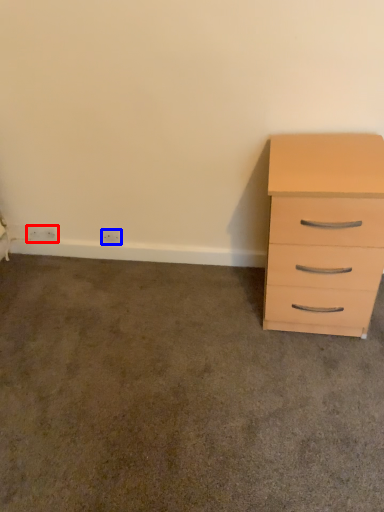
Question: Which point is closer to the camera, electric outlet (highlighted by a red box) or electric outlet (highlighted by a blue box)?

Choices:
 (A) electric outlet
 (B) electric outlet

Answer: (B)